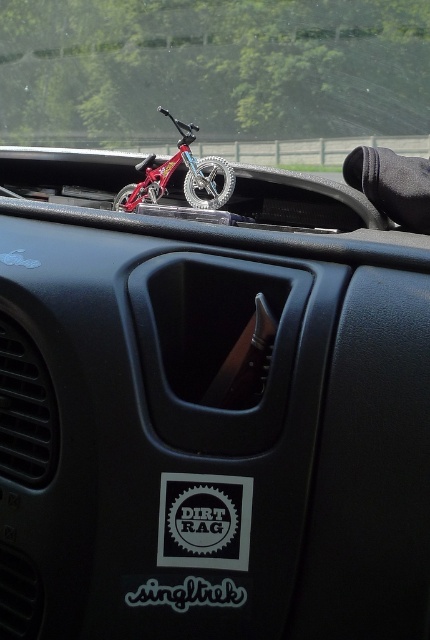
Question: Which point is farther from the camera taking this photo?

Choices:
 (A) (6, 48)
 (B) (227, 182)

Answer: (A)

Question: Can you confirm if clear glass windshield at upper center is wider than metallic red bicycle at center?

Choices:
 (A) no
 (B) yes

Answer: (B)

Question: Which point is farther to the camera?

Choices:
 (A) (82, 3)
 (B) (168, 163)

Answer: (A)

Question: Where is clear glass windshield at upper center located in relation to metallic red bicycle at center in the image?

Choices:
 (A) below
 (B) above

Answer: (B)

Question: Is clear glass windshield at upper center closer to camera compared to metallic red bicycle at center?

Choices:
 (A) no
 (B) yes

Answer: (A)